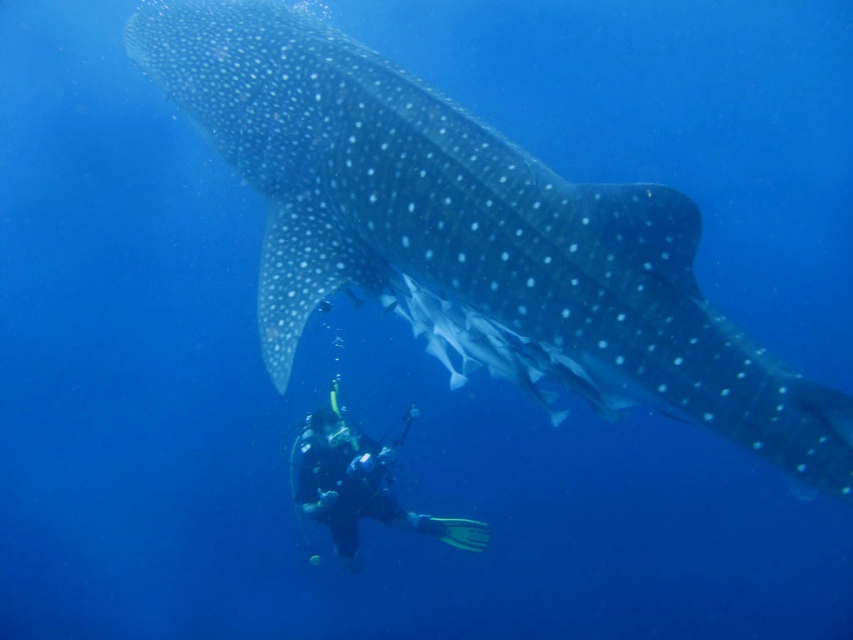
Question: Can you confirm if smooth gray shark at center is smaller than black rubber wetsuit at lower center?

Choices:
 (A) yes
 (B) no

Answer: (B)

Question: Which point is closer to the camera?

Choices:
 (A) smooth gray shark at center
 (B) black rubber wetsuit at lower center

Answer: (A)

Question: Is smooth gray shark at center further to the viewer compared to black rubber wetsuit at lower center?

Choices:
 (A) no
 (B) yes

Answer: (A)

Question: Does smooth gray shark at center have a larger size compared to black rubber wetsuit at lower center?

Choices:
 (A) no
 (B) yes

Answer: (B)